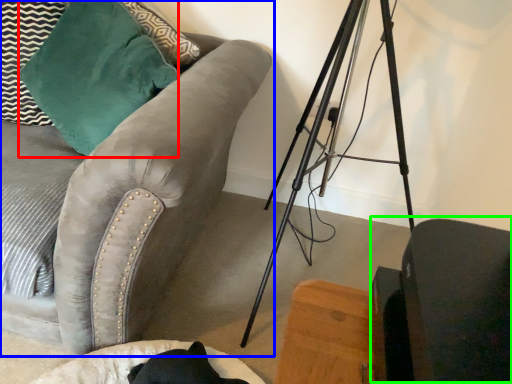
Question: Based on their relative distances, which object is farther from throw pillow (highlighted by a red box)? Choose from studio couch (highlighted by a blue box) and swivel chair (highlighted by a green box).

Choices:
 (A) studio couch
 (B) swivel chair

Answer: (B)